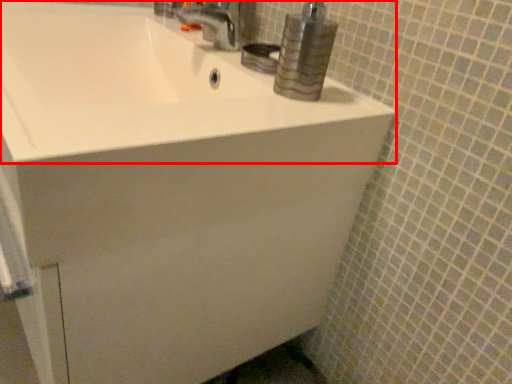
Question: From the image's perspective, where is sink (annotated by the red box) located in relation to tap in the image?

Choices:
 (A) below
 (B) above

Answer: (A)